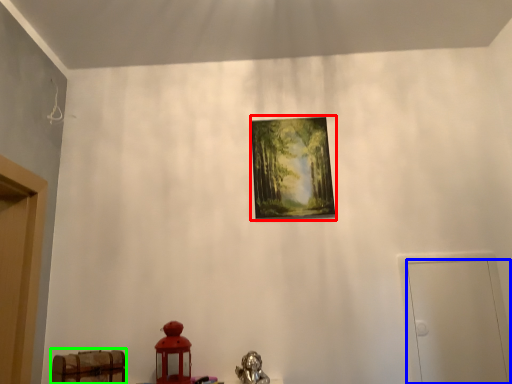
Question: Which is nearer to the picture frame (highlighted by a red box)? door (highlighted by a blue box) or furniture (highlighted by a green box).

Choices:
 (A) door
 (B) furniture

Answer: (A)